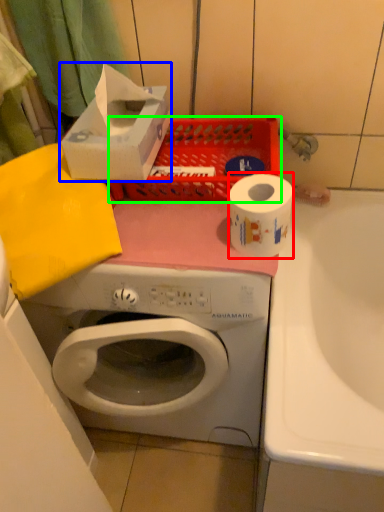
Question: Based on their relative distances, which object is farther from toilet paper (highlighted by a red box)? Choose from storage box (highlighted by a blue box) and basket (highlighted by a green box).

Choices:
 (A) storage box
 (B) basket

Answer: (A)